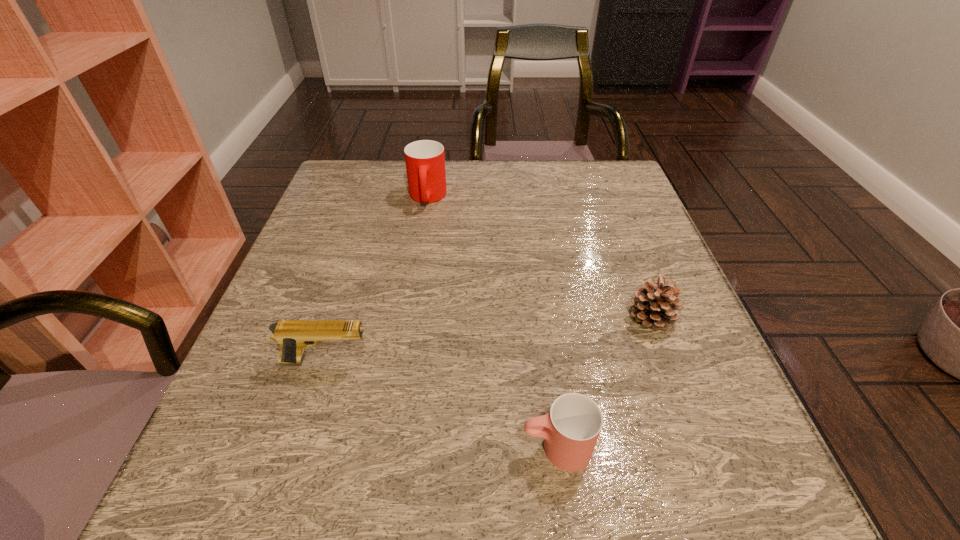
This screenshot has width=960, height=540. I want to click on vacant space at the left edge of the desktop, so click(x=348, y=321).

You are a GUI agent. You are given a task and a screenshot of the screen. Output one action in this format:
    pyautogui.click(x=<x>, y=<y>)
    Task: Click on the vacant space at the right edge of the desktop
    This screenshot has height=540, width=960.
    Given the screenshot: What is the action you would take?
    pyautogui.click(x=631, y=375)

What are the coordinates of `vacant space at the far left corner` in the screenshot? It's located at (392, 170).

Identify the location of vacant space at the near right corner of the desktop. (656, 483).

You are a GUI agent. You are given a task and a screenshot of the screen. Output one action in this format:
    pyautogui.click(x=<x>, y=<y>)
    Task: Click on the free space that is in between the leftmost object and the shorter cup
    
    Given the screenshot: What is the action you would take?
    pyautogui.click(x=442, y=404)

Find the location of a particular element. This screenshot has width=960, height=540. free point between the pinecone and the leftmost object is located at coordinates (490, 339).

Locate an element on the screen. vacant region between the second object from right to left and the third farthest object is located at coordinates (442, 404).

Where is `free spot between the taller cup and the third nearest object`? This screenshot has height=540, width=960. free spot between the taller cup and the third nearest object is located at coordinates (540, 257).

Where is `vacant region between the tallest object and the nearer cup`? The image size is (960, 540). vacant region between the tallest object and the nearer cup is located at coordinates (492, 322).

I want to click on empty space between the rightmost object and the third farthest object, so [490, 339].